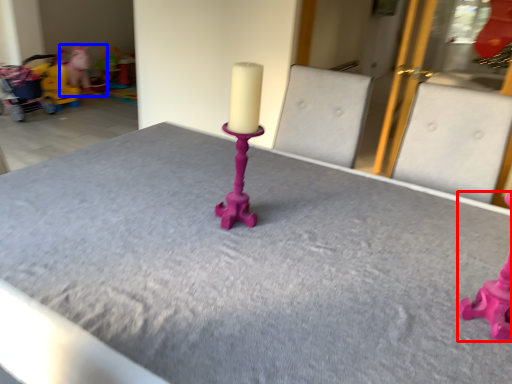
Question: Which object is closer to the camera taking this photo, toy (highlighted by a red box) or toy (highlighted by a blue box)?

Choices:
 (A) toy
 (B) toy

Answer: (A)